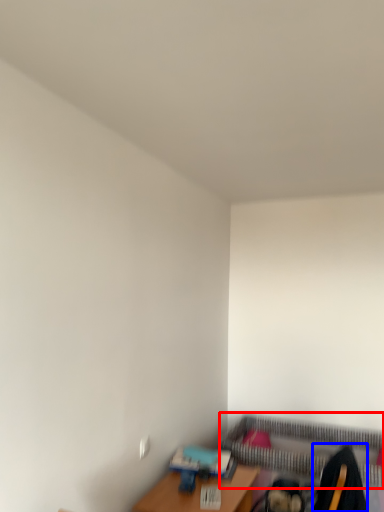
Question: Among these objects, which one is nearest to the camera, bed frame (highlighted by a red box) or swivel chair (highlighted by a blue box)?

Choices:
 (A) bed frame
 (B) swivel chair

Answer: (B)